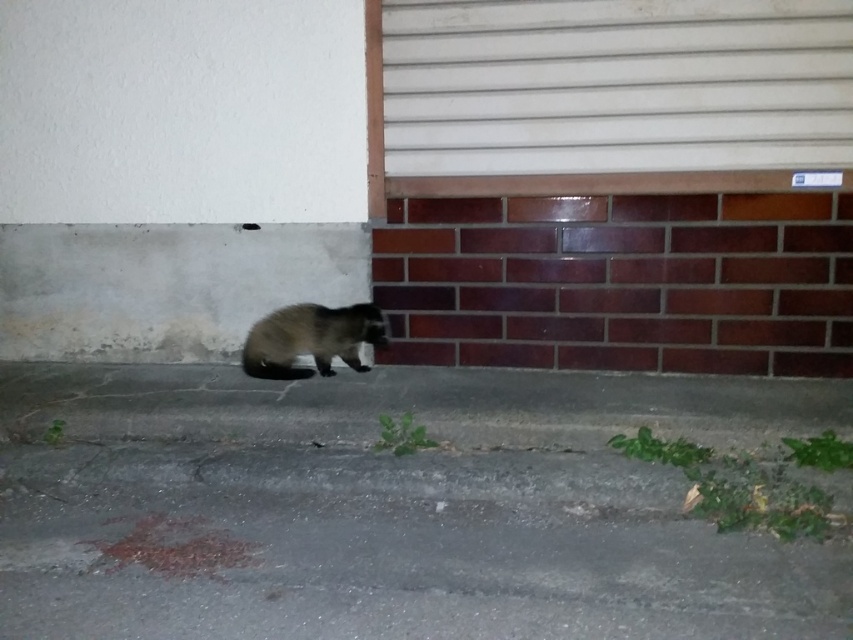
Based on the photo, is gray asphalt pavement at lower center positioned in front of fuzzy brown fur at lower center?

Yes, it is in front of fuzzy brown fur at lower center.

Is gray asphalt pavement at lower center taller than fuzzy brown fur at lower center?

No, gray asphalt pavement at lower center is not taller than fuzzy brown fur at lower center.

This screenshot has width=853, height=640. I want to click on gray asphalt pavement at lower center, so click(387, 548).

Is gray concrete curb at lower center wider than fuzzy brown fur at lower center?

Yes, gray concrete curb at lower center is wider than fuzzy brown fur at lower center.

How much distance is there between gray concrete curb at lower center and fuzzy brown fur at lower center?

gray concrete curb at lower center and fuzzy brown fur at lower center are 13.57 inches apart.

Is point (241, 435) positioned after point (376, 339)?

No, it is in front of (376, 339).

Where is `gray concrete curb at lower center`? The height and width of the screenshot is (640, 853). gray concrete curb at lower center is located at coordinates (415, 404).

You are a GUI agent. You are given a task and a screenshot of the screen. Output one action in this format:
    pyautogui.click(x=<x>, y=<y>)
    Task: Click on the gray asphalt pavement at lower center
    
    Given the screenshot: What is the action you would take?
    pyautogui.click(x=387, y=548)

Measure the distance between point [291,449] and camera.

Point [291,449] and camera are 9.42 feet apart.

Where is `gray asphalt pavement at lower center`? gray asphalt pavement at lower center is located at coordinates (387, 548).

Identify the location of gray asphalt pavement at lower center. This screenshot has height=640, width=853. (387, 548).